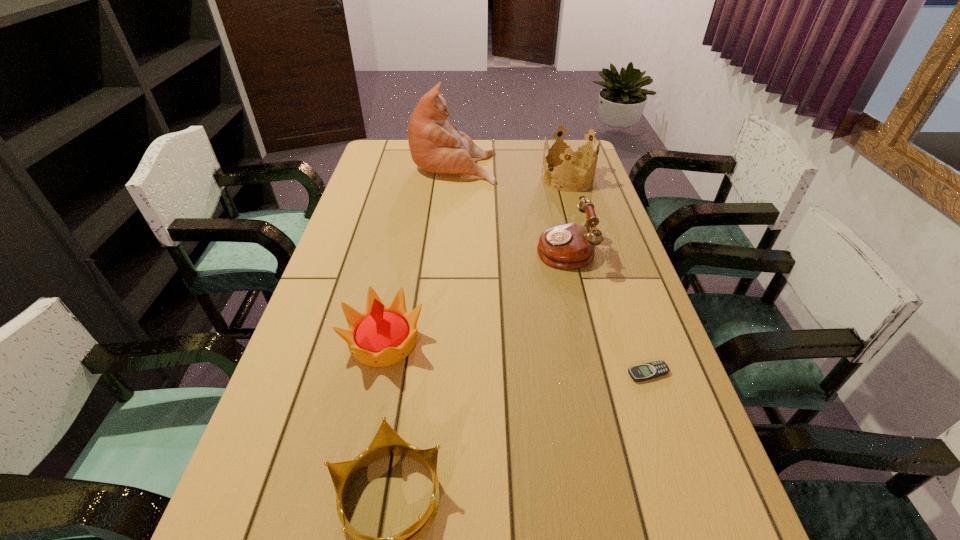
The image size is (960, 540). Find the location of `cat`. cat is located at coordinates (436, 145).

I want to click on the farthest crown, so click(571, 152).

Identify the location of telephone. (570, 246).

The width and height of the screenshot is (960, 540). Find the location of `the second farthest crown`. the second farthest crown is located at coordinates (381, 336).

The width and height of the screenshot is (960, 540). In order to click on beeper in this screenshot , I will do point(651,370).

This screenshot has height=540, width=960. I want to click on blank space located on the face of the cat, so click(529, 164).

At what (x,y) coordinates should I click in order to perform the action: click on free point located 0.250m on the left of the rightmost crown. Please return your answer as a coordinate pair (x, y). The width and height of the screenshot is (960, 540). Looking at the image, I should click on (473, 178).

The height and width of the screenshot is (540, 960). Identify the location of vacant region located 0.240m on the dial of the telephone. (456, 248).

Where is `vacant area situated 0.400m on the dial of the telephone`? vacant area situated 0.400m on the dial of the telephone is located at coordinates (403, 248).

What are the coordinates of `vacant space situated on the dial of the telephone` in the screenshot? It's located at (429, 248).